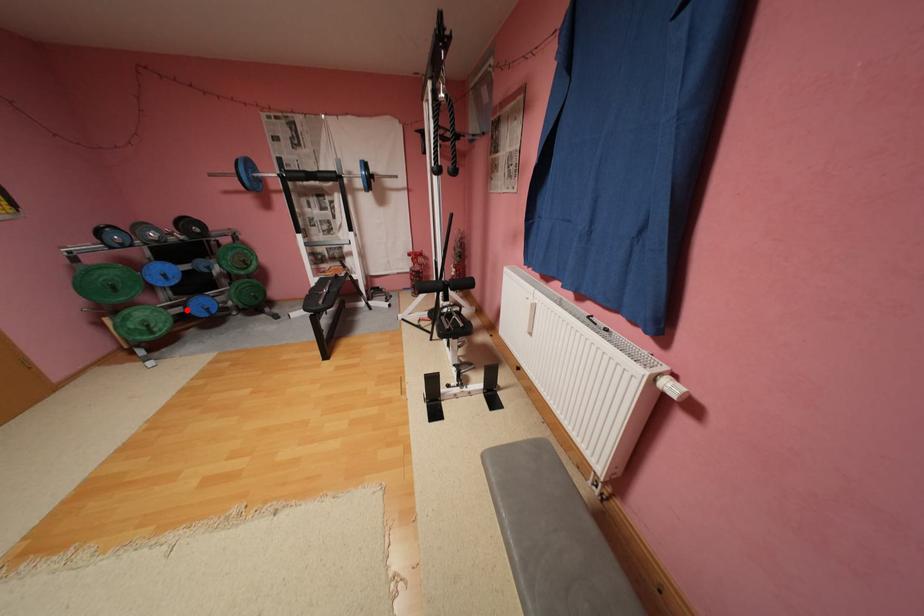
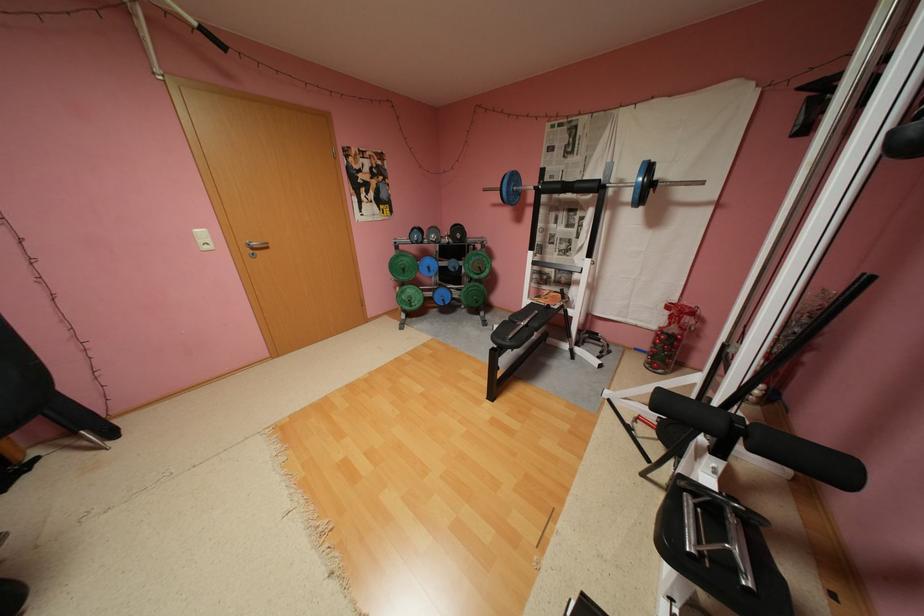
Find the pixel in the second image that matches the highlighted location in the first image.

(439, 294)